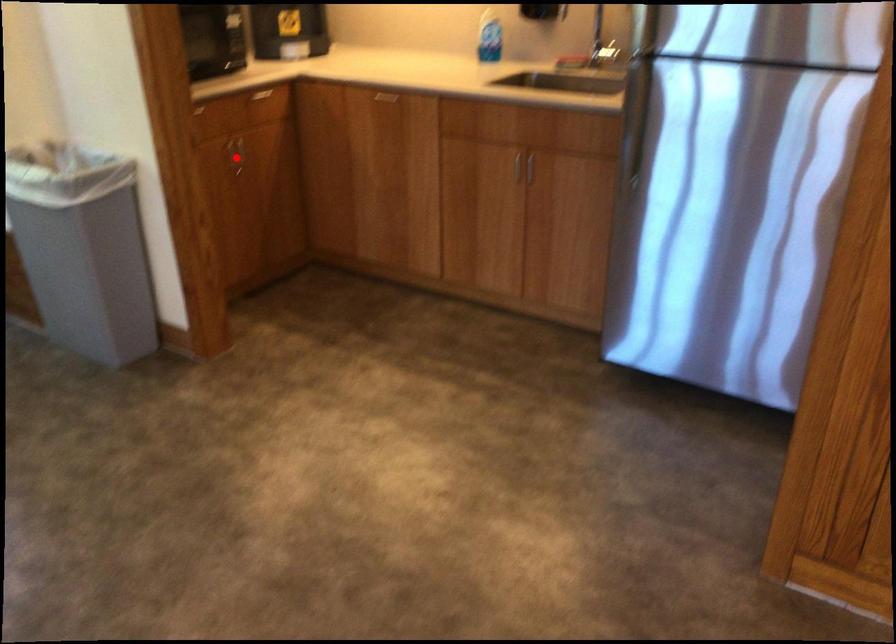
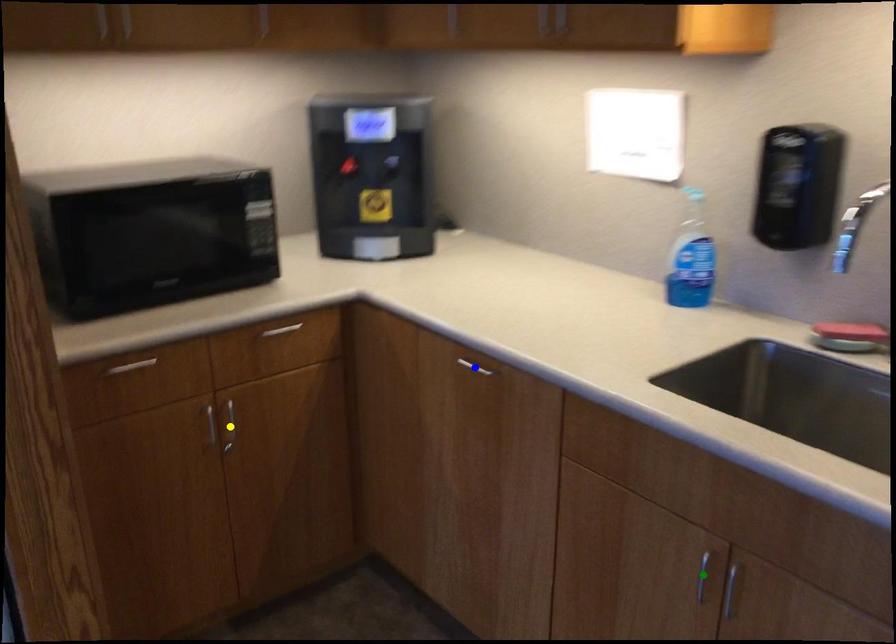
Question: I am providing you with two images of the same scene from different viewpoints. A red point is marked on the first image. You are given multiple points on the second image. In image 2, which mark is for the same physical point as the one in image 1?

Choices:
 (A) yellow point
 (B) blue point
 (C) green point

Answer: (A)